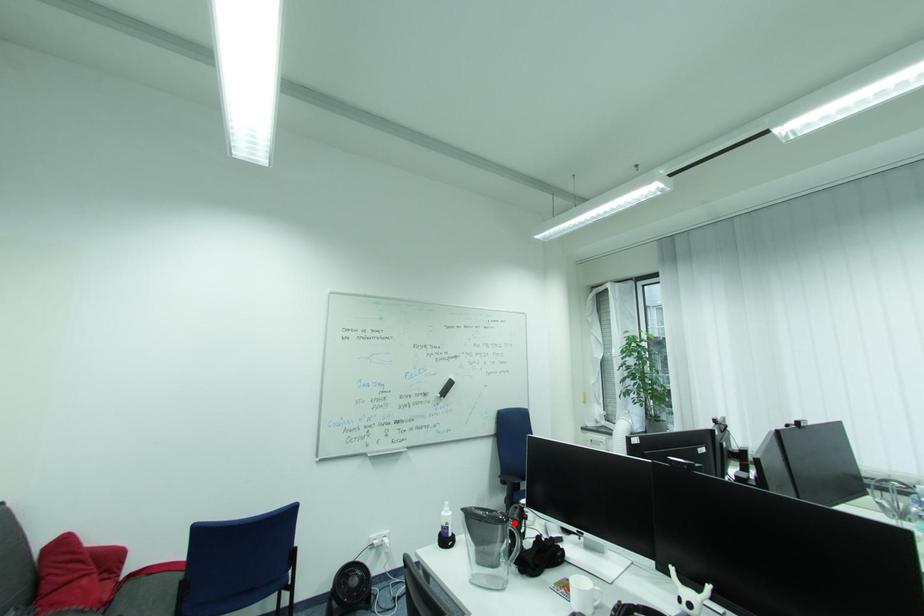
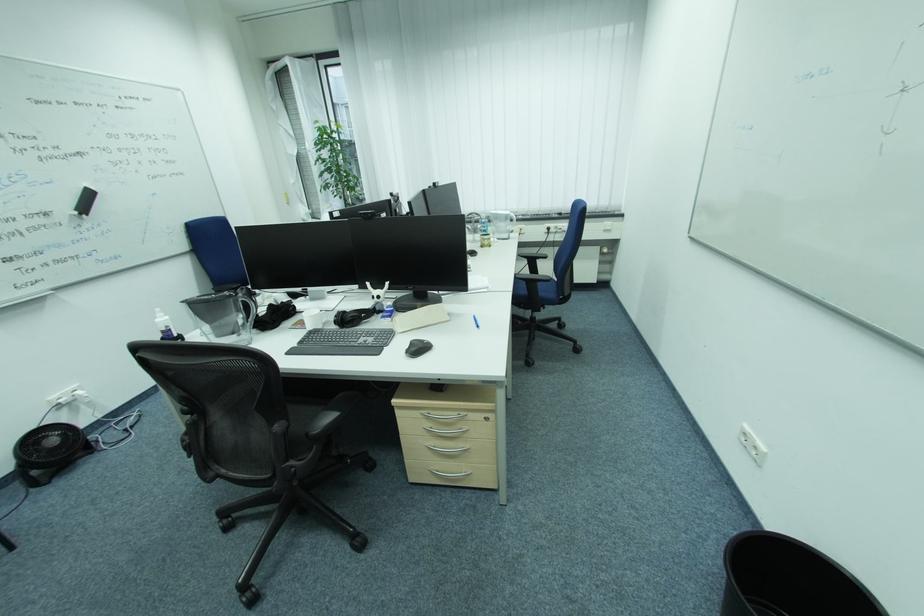
The point at the highlighted location is marked in the first image. Where is the corresponding point in the second image?

(242, 294)